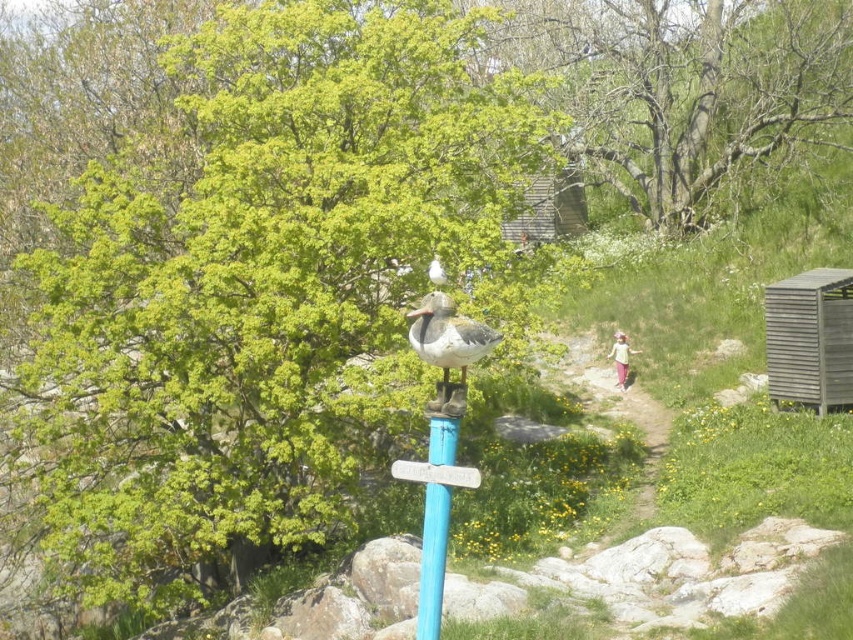
You are standing at point (263, 282) in the image. What object is located exactly at this point?

The green leafy tree at center is located exactly at point (263, 282).

You are a bird flying over the scene and want to land on the tallest tree. Which tree should you choose between the green leafy tree at center and the green leafy tree at upper center?

The green leafy tree at center is larger in size than the green leafy tree at upper center, so you should choose the green leafy tree at center to land on as it is taller.

You are a gardener who wants to hang a bird feeder between the wooden shed at right and the white matte duck at center. Based on their positions, can you place the feeder in a spot where both objects are visible from the feeder?

The white matte duck at center is behind the wooden shed at right, so placing the feeder between them would mean the shed blocks the view of the duck. Therefore, the feeder cannot be placed where both are visible.